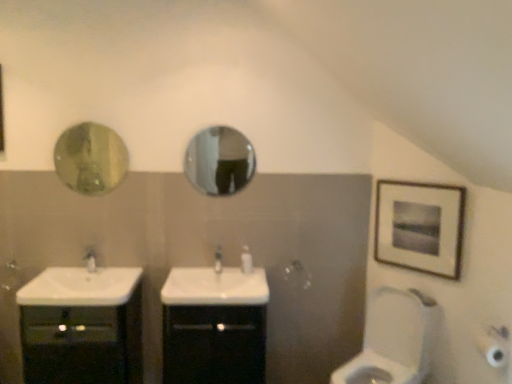
Question: Looking at the image, does wooden framed artwork at upper right seem bigger or smaller compared to white glossy tap at center, positioned as the first tap in left-to-right order?

Choices:
 (A) small
 (B) big

Answer: (B)

Question: From their relative heights in the image, would you say wooden framed artwork at upper right is taller or shorter than white glossy tap at center, the second tap viewed from the right?

Choices:
 (A) tall
 (B) short

Answer: (A)

Question: Which object is the farthest from the white glossy tap at center, the second tap viewed from the right?

Choices:
 (A) white glossy toilet at lower right
 (B) green glass mirror at upper left, which ranks as the 2th mirror in right-to-left order
 (C) black glossy cabinet at lower left, marked as the 2th bathroom cabinet in a right-to-left arrangement
 (D) black glossy cabinet at center, the second bathroom cabinet from the left
 (E) matte silver towel bar at center

Answer: (A)

Question: Which object is the closest to the glossy metallic mirror at center, which appears as the 2th mirror when viewed from the left?

Choices:
 (A) white glossy soap dispenser at center
 (B) white glossy tap at center, marked as the 1th tap in a right-to-left arrangement
 (C) white glossy sink at center, the 2th sink positioned from the left
 (D) white glossy toilet at lower right
 (E) wooden framed artwork at upper right

Answer: (B)